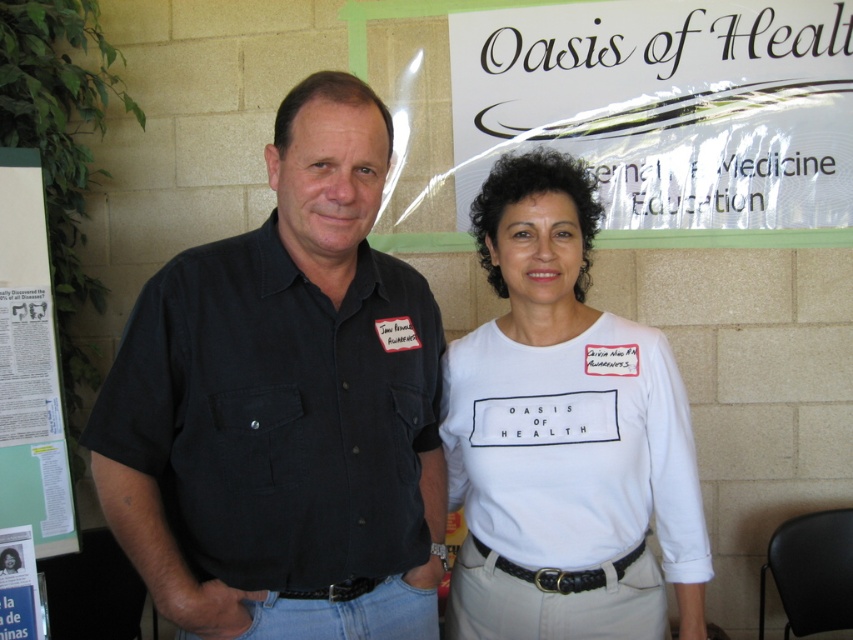
Question: Does black cotton shirt at center have a larger size compared to white glossy signboard at upper center?

Choices:
 (A) yes
 (B) no

Answer: (A)

Question: Is white cotton shirt at center in front of white paper at left?

Choices:
 (A) yes
 (B) no

Answer: (A)

Question: Is white paper at left above white paper poster at lower left?

Choices:
 (A) yes
 (B) no

Answer: (A)

Question: Which point is farther to the camera?

Choices:
 (A) (30, 584)
 (B) (184, 380)
 (C) (32, 458)

Answer: (C)

Question: Which of the following is the farthest from the observer?

Choices:
 (A) white paper at left
 (B) white cotton shirt at center

Answer: (A)

Question: Among these objects, which one is farthest from the camera?

Choices:
 (A) white cotton shirt at center
 (B) white paper poster at lower left
 (C) black cotton shirt at center
 (D) white glossy signboard at upper center

Answer: (D)